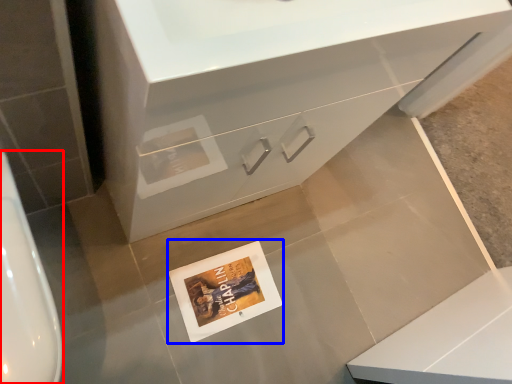
Question: Among these objects, which one is nearest to the camera, urinal (highlighted by a red box) or postcard (highlighted by a blue box)?

Choices:
 (A) urinal
 (B) postcard

Answer: (A)